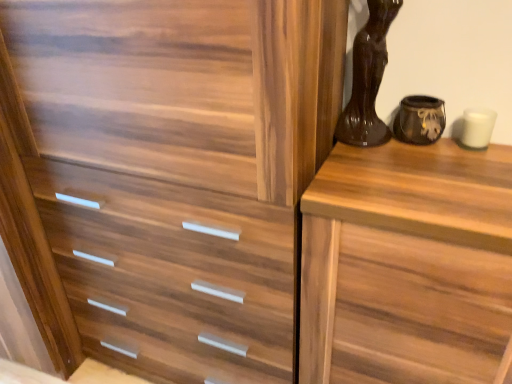
Question: Does wooden chest of drawers at right have a lesser width compared to matte black vase at upper right, marked as the 1th vase in a right-to-left arrangement?

Choices:
 (A) no
 (B) yes

Answer: (A)

Question: Is matte black vase at upper right, marked as the 1th vase in a right-to-left arrangement, at the back of wooden chest of drawers at right?

Choices:
 (A) no
 (B) yes

Answer: (A)

Question: Does wooden chest of drawers at right come in front of matte black vase at upper right, arranged as the 2th vase when viewed from the left?

Choices:
 (A) no
 (B) yes

Answer: (B)

Question: Is wooden chest of drawers at right shorter than matte black vase at upper right, marked as the 1th vase in a right-to-left arrangement?

Choices:
 (A) no
 (B) yes

Answer: (A)

Question: Is wooden chest of drawers at right outside matte black vase at upper right, marked as the 1th vase in a right-to-left arrangement?

Choices:
 (A) no
 (B) yes

Answer: (B)

Question: Is the depth of wooden chest of drawers at right greater than that of matte black vase at upper right, marked as the 1th vase in a right-to-left arrangement?

Choices:
 (A) no
 (B) yes

Answer: (A)

Question: Is wooden chest of drawers at right located within shiny brown vase at upper right, which is the 2th vase in right-to-left order?

Choices:
 (A) yes
 (B) no

Answer: (B)

Question: Is the position of shiny brown vase at upper right, which is the 2th vase in right-to-left order, less distant than that of wooden chest of drawers at right?

Choices:
 (A) no
 (B) yes

Answer: (A)

Question: Does shiny brown vase at upper right, the first vase from the left, have a lesser width compared to wooden chest of drawers at right?

Choices:
 (A) no
 (B) yes

Answer: (B)

Question: From the image's perspective, is shiny brown vase at upper right, which is the 2th vase in right-to-left order, over wooden chest of drawers at right?

Choices:
 (A) yes
 (B) no

Answer: (A)

Question: Can you confirm if shiny brown vase at upper right, the first vase from the left, is positioned to the right of wooden chest of drawers at right?

Choices:
 (A) no
 (B) yes

Answer: (A)

Question: Is shiny brown vase at upper right, which is the 2th vase in right-to-left order, oriented away from wooden chest of drawers at right?

Choices:
 (A) yes
 (B) no

Answer: (B)

Question: Does matte black vase at upper right, arranged as the 2th vase when viewed from the left, have a larger size compared to wooden chest of drawers at right?

Choices:
 (A) yes
 (B) no

Answer: (B)